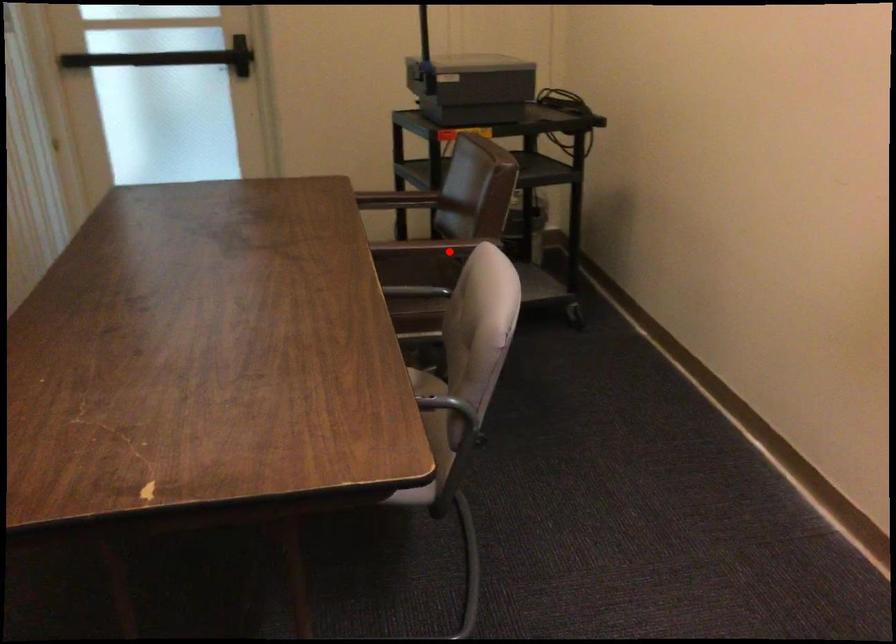
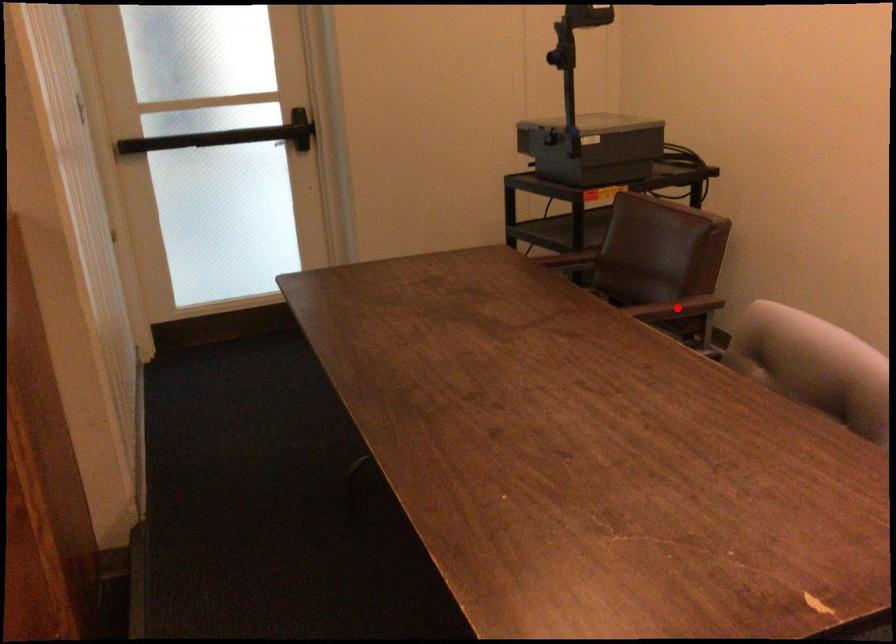
I am providing you with two images of the same scene from different viewpoints. A red point is marked on the first image and another point is marked on the second image. Do the highlighted points in image1 and image2 indicate the same real-world spot?

Yes